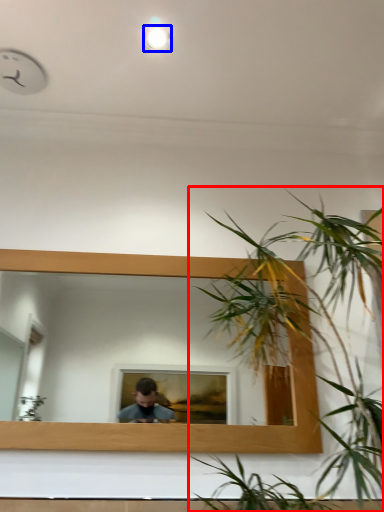
Question: Among these objects, which one is farthest to the camera, houseplant (highlighted by a red box) or light (highlighted by a blue box)?

Choices:
 (A) houseplant
 (B) light

Answer: (B)